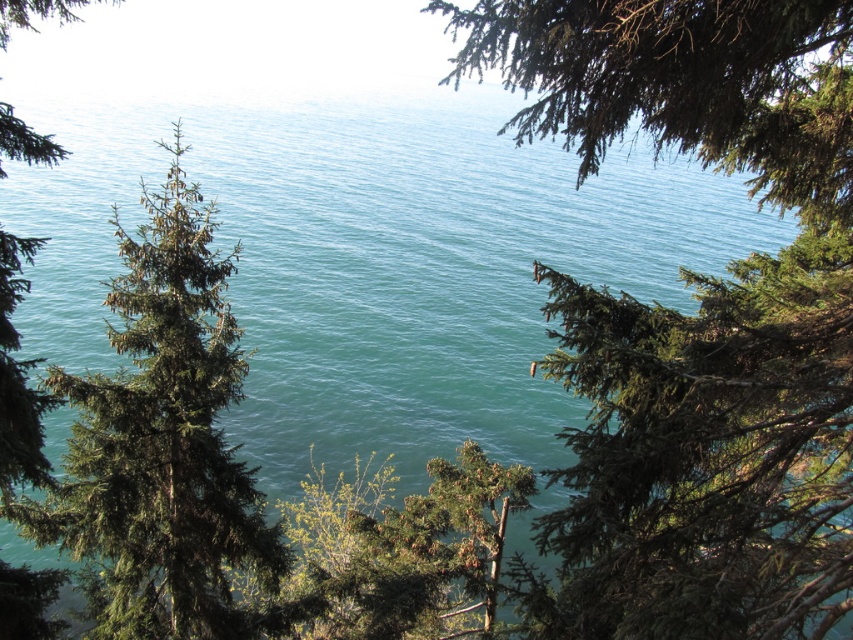
What do you see at coordinates (697, 320) in the screenshot? The height and width of the screenshot is (640, 853). I see `green needle-like foliage at center` at bounding box center [697, 320].

Between point (824, 355) and point (625, 40), which one is positioned in front?

Point (625, 40) is more forward.

Locate an element on the screen. green needle-like foliage at center is located at coordinates (697, 320).

Can you confirm if green needle-like foliage at center is positioned below green needle-like pine at left?

Actually, green needle-like foliage at center is above green needle-like pine at left.

Which of these two, green needle-like foliage at center or green needle-like pine at left, stands taller?

green needle-like foliage at center

The width and height of the screenshot is (853, 640). What are the coordinates of `green needle-like foliage at center` in the screenshot? It's located at (697, 320).

Can you confirm if green needle-like pine at left is bigger than green matte tree at upper right?

Actually, green needle-like pine at left might be smaller than green matte tree at upper right.

Is green needle-like pine at left to the left of green matte tree at upper right from the viewer's perspective?

Correct, you'll find green needle-like pine at left to the left of green matte tree at upper right.

Between point (161, 460) and point (590, 147), which one is positioned behind?

Point (161, 460)

At what (x,y) coordinates should I click in order to perform the action: click on green needle-like pine at left. Please return your answer as a coordinate pair (x, y). The width and height of the screenshot is (853, 640). Looking at the image, I should click on (161, 440).